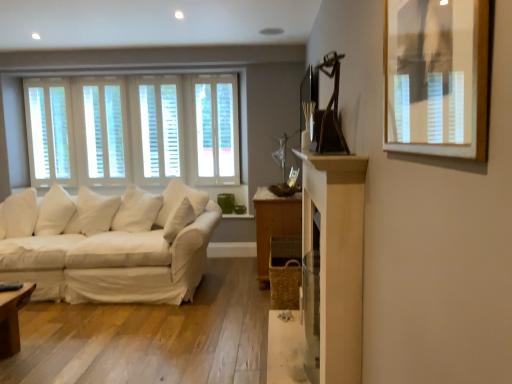
You are a GUI agent. You are given a task and a screenshot of the screen. Output one action in this format:
    pyautogui.click(x=<x>, y=<y>)
    Task: Click on the white wood blinds at left, arranged as the 2th window when viewed from the right
    
    Given the screenshot: What is the action you would take?
    coord(50,131)

Locate an element on the screen. The width and height of the screenshot is (512, 384). white fabric couch at left is located at coordinates (x=111, y=246).

The image size is (512, 384). Describe the element at coordinates (437, 77) in the screenshot. I see `wooden framed picture at upper right` at that location.

Identify the location of white wood blinds at left, the first window in the left-to-right sequence. (50, 131).

Would you say white wood blinds at left, the first window in the left-to-right sequence, is outside white fabric couch at left?

Yes, white wood blinds at left, the first window in the left-to-right sequence, is located beyond the bounds of white fabric couch at left.

Which of these two, white wood blinds at left, the first window in the left-to-right sequence, or white fabric couch at left, is bigger?

Bigger between the two is white fabric couch at left.

In the scene shown: Is white wood blinds at left, the first window in the left-to-right sequence, looking in the opposite direction of white fabric couch at left?

No, white fabric couch at left is not at the back of white wood blinds at left, the first window in the left-to-right sequence.

Can you confirm if white wood blinds at left, the first window in the left-to-right sequence, is wider than white fabric couch at left?

No.

Which of these two, wooden framed picture at upper right or wooden dresser at center, is smaller?

With smaller size is wooden framed picture at upper right.

From a real-world perspective, is wooden framed picture at upper right physically located above or below wooden dresser at center?

Clearly, from a real-world perspective, wooden framed picture at upper right is above wooden dresser at center.

How many degrees apart are the facing directions of wooden framed picture at upper right and wooden dresser at center?

0.409 degrees separate the facing orientations of wooden framed picture at upper right and wooden dresser at center.

From the image's perspective, is wooden framed picture at upper right above wooden dresser at center?

Yes.

Is white fabric couch at left taller or shorter than wooden framed picture at upper right?

Considering their sizes, white fabric couch at left has more height than wooden framed picture at upper right.

From the image's perspective, is white fabric couch at left under wooden framed picture at upper right?

Yes.

In the scene shown: From a real-world perspective, which is physically above, white fabric couch at left or wooden framed picture at upper right?

In real-world perspective, wooden framed picture at upper right is above.

Does white fabric couch at left have a lesser width compared to wooden framed picture at upper right?

In fact, white fabric couch at left might be wider than wooden framed picture at upper right.

Is white wood blinds at left, the first window in the left-to-right sequence, facing towards wooden dresser at center?

No.

Image resolution: width=512 pixels, height=384 pixels. Find the location of `the 2nd window counting from the left side of the wooden dresser at center`. the 2nd window counting from the left side of the wooden dresser at center is located at coordinates (50, 131).

Does point (33, 135) lie in front of point (271, 227)?

No, (33, 135) is further to viewer.

Is white wood window at center, which is the 2th window from left to right, thinner than white fabric couch at left?

Yes.

From a real-world perspective, relative to white fabric couch at left, is white wood window at center, which is the 2th window from left to right, vertically above or below?

Clearly, from a real-world perspective, white wood window at center, which is the 2th window from left to right, is above white fabric couch at left.

Is point (216, 131) closer or farther from the camera than point (59, 228)?

Clearly, point (216, 131) is more distant from the camera than point (59, 228).

Is wooden dresser at center in contact with white wood blinds at left, arranged as the 2th window when viewed from the right?

They are not placed beside each other.

Does wooden dresser at center turn towards white wood blinds at left, the first window in the left-to-right sequence?

Yes, wooden dresser at center faces towards white wood blinds at left, the first window in the left-to-right sequence.

From a real-world perspective, between wooden dresser at center and white wood blinds at left, the first window in the left-to-right sequence, who is vertically higher?

From a 3D spatial view, white wood blinds at left, the first window in the left-to-right sequence, is above.

Is white fabric couch at left next to wooden dresser at center and touching it?

white fabric couch at left and wooden dresser at center are not in contact.

Who is more distant, white fabric couch at left or wooden dresser at center?

wooden dresser at center is behind.

From their relative heights in the image, would you say white fabric couch at left is taller or shorter than wooden dresser at center?

Clearly, white fabric couch at left is shorter compared to wooden dresser at center.

Can you tell me how much white fabric couch at left and wooden dresser at center differ in facing direction?

They differ by 90 degrees in their facing directions.

Identify the location of studio couch in front of the white wood blinds at left, the first window in the left-to-right sequence. This screenshot has width=512, height=384. (111, 246).

Find the location of a particular element. Image resolution: width=512 pixels, height=384 pixels. dresser to the left of wooden framed picture at upper right is located at coordinates (274, 225).

Based on their spatial positions, is white wood blinds at left, arranged as the 2th window when viewed from the right, or wooden framed picture at upper right further from wooden dresser at center?

The object further to wooden dresser at center is white wood blinds at left, arranged as the 2th window when viewed from the right.

Which object lies nearer to the anchor point wooden dresser at center, white fabric couch at left or wooden framed picture at upper right?

white fabric couch at left is positioned closer to the anchor wooden dresser at center.

Based on their spatial positions, is white wood blinds at left, the first window in the left-to-right sequence, or white wood window at center, which is counted as the 1th window, starting from the right, further from wooden dresser at center?

white wood blinds at left, the first window in the left-to-right sequence, is further to wooden dresser at center.

Considering their positions, is wooden framed picture at upper right positioned closer to wooden dresser at center than white wood blinds at left, the first window in the left-to-right sequence?

wooden framed picture at upper right lies closer to wooden dresser at center than the other object.

Based on the photo, which object lies further to the anchor point white wood window at center, which is the 2th window from left to right, white fabric couch at left or wooden dresser at center?

white fabric couch at left.

From the image, which object appears to be farther from white wood blinds at left, arranged as the 2th window when viewed from the right, white wood window at center, which is counted as the 1th window, starting from the right, or wooden dresser at center?

The object further to white wood blinds at left, arranged as the 2th window when viewed from the right, is wooden dresser at center.

Looking at the image, which one is located closer to wooden framed picture at upper right, white wood blinds at left, the first window in the left-to-right sequence, or wooden dresser at center?

wooden dresser at center lies closer to wooden framed picture at upper right than the other object.

Estimate the real-world distances between objects in this image. Which object is further from wooden framed picture at upper right, white wood window at center, which is counted as the 1th window, starting from the right, or white wood blinds at left, arranged as the 2th window when viewed from the right?

Among the two, white wood blinds at left, arranged as the 2th window when viewed from the right, is located further to wooden framed picture at upper right.

Locate an element on the screen. This screenshot has width=512, height=384. dresser between wooden framed picture at upper right and white wood window at center, which is counted as the 1th window, starting from the right, along the z-axis is located at coordinates 274,225.

Locate an element on the screen. studio couch located between wooden framed picture at upper right and white wood blinds at left, the first window in the left-to-right sequence, in the depth direction is located at coordinates (111, 246).

At what (x,y) coordinates should I click in order to perform the action: click on studio couch between wooden framed picture at upper right and wooden dresser at center along the z-axis. Please return your answer as a coordinate pair (x, y). This screenshot has height=384, width=512. Looking at the image, I should click on (111, 246).

Where is `window between white fabric couch at left and wooden dresser at center in the horizontal direction`? window between white fabric couch at left and wooden dresser at center in the horizontal direction is located at coordinates (216, 129).